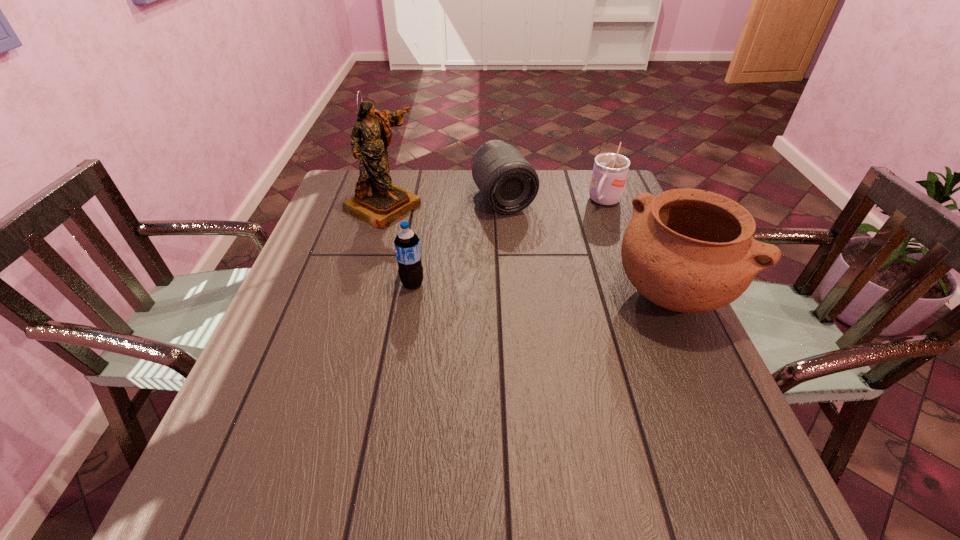
Find the location of a particular element. soda bottle is located at coordinates (407, 244).

Identify the location of the fourth shortest object. The image size is (960, 540). (687, 250).

What are the coordinates of `the tallest object` in the screenshot? It's located at (377, 201).

At what (x,y) coordinates should I click in order to perform the action: click on telephoto lens. Please return your answer as a coordinate pair (x, y). The height and width of the screenshot is (540, 960). Looking at the image, I should click on (508, 183).

Locate an element on the screen. The width and height of the screenshot is (960, 540). cup is located at coordinates (610, 170).

The width and height of the screenshot is (960, 540). In order to click on vacant space located on the front of the soda bottle in this screenshot , I will do `click(387, 436)`.

Where is `vacant space located 0.080m on the left of the pottery`? The width and height of the screenshot is (960, 540). vacant space located 0.080m on the left of the pottery is located at coordinates (579, 294).

You are a GUI agent. You are given a task and a screenshot of the screen. Output one action in this format:
    pyautogui.click(x=<x>, y=<y>)
    Task: Click on the free space located 0.180m on the front-facing side of the figurine
    The width and height of the screenshot is (960, 540).
    Given the screenshot: What is the action you would take?
    pyautogui.click(x=454, y=246)

Find the location of `vacant position located on the front-facing side of the figurine`. vacant position located on the front-facing side of the figurine is located at coordinates (438, 237).

This screenshot has height=540, width=960. Identify the location of free space located on the front-facing side of the figurine. (459, 249).